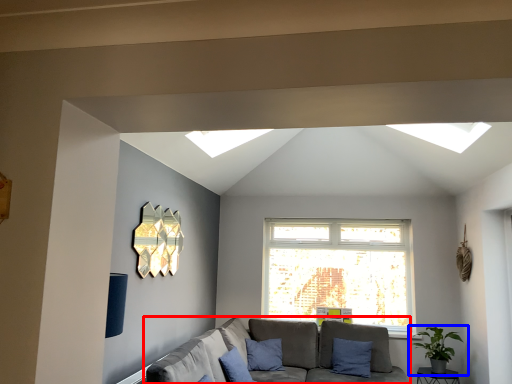
Question: Which of the following is the farthest to the observer, studio couch (highlighted by a red box) or houseplant (highlighted by a blue box)?

Choices:
 (A) studio couch
 (B) houseplant

Answer: (B)